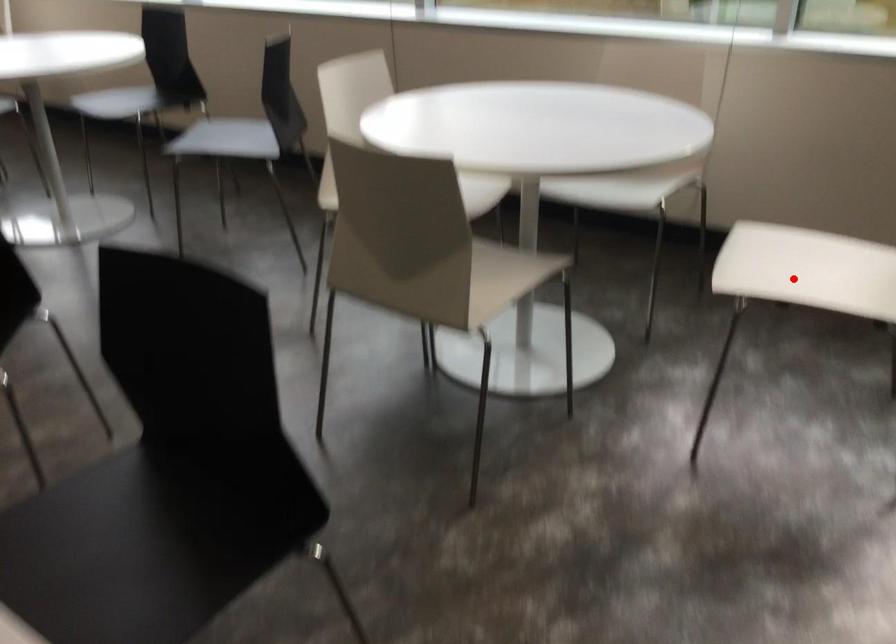
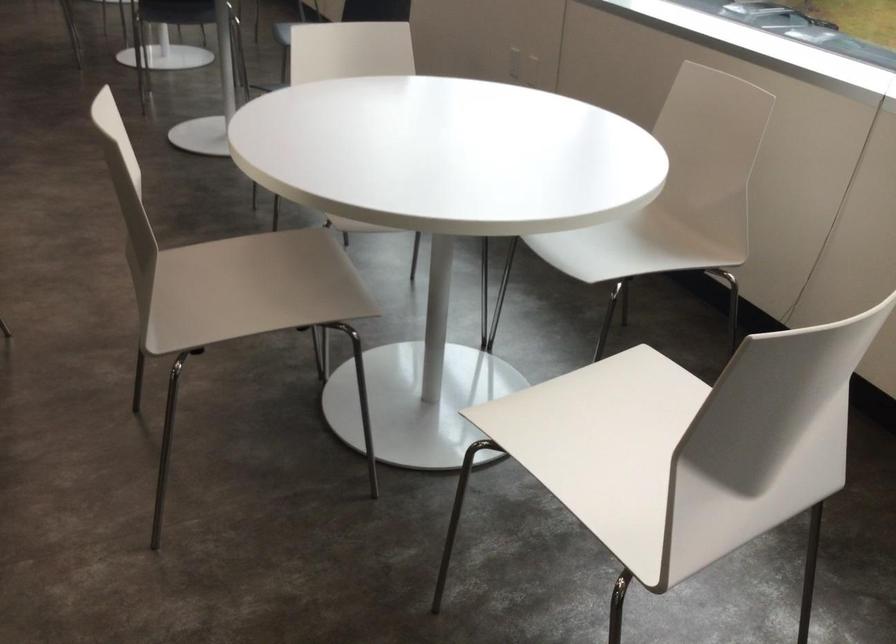
Question: I am providing you with two images of the same scene from different viewpoints. Given a red point in image1, look at the same physical point in image2. Is it:

Choices:
 (A) Closer to the viewpoint
 (B) Farther from the viewpoint

Answer: (A)